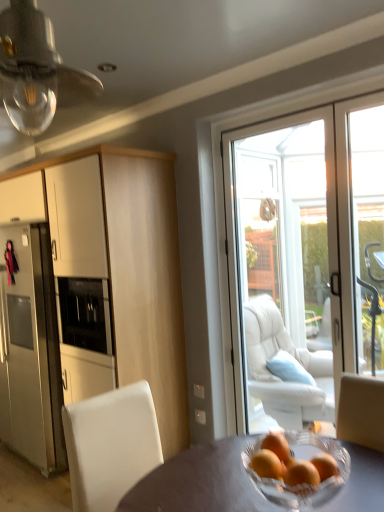
Question: Considering the relative sizes of matte gray table at center and matte white cabinet at left in the image provided, is matte gray table at center thinner than matte white cabinet at left?

Choices:
 (A) no
 (B) yes

Answer: (A)

Question: Is matte gray table at center outside of matte white cabinet at left?

Choices:
 (A) no
 (B) yes

Answer: (B)

Question: From a real-world perspective, is matte gray table at center over matte white cabinet at left?

Choices:
 (A) yes
 (B) no

Answer: (B)

Question: Is matte gray table at center oriented away from matte white cabinet at left?

Choices:
 (A) yes
 (B) no

Answer: (B)

Question: From the image's perspective, is matte gray table at center located beneath matte white cabinet at left?

Choices:
 (A) yes
 (B) no

Answer: (A)

Question: Is matte white cabinet at left inside matte gray table at center?

Choices:
 (A) yes
 (B) no

Answer: (B)

Question: Is clear glass bulb at upper left to the right of white glass door at center from the viewer's perspective?

Choices:
 (A) yes
 (B) no

Answer: (B)

Question: From a real-world perspective, is clear glass bulb at upper left on white glass door at center?

Choices:
 (A) no
 (B) yes

Answer: (B)

Question: Does clear glass bulb at upper left have a smaller size compared to white glass door at center?

Choices:
 (A) yes
 (B) no

Answer: (A)

Question: From a real-world perspective, is clear glass bulb at upper left beneath white glass door at center?

Choices:
 (A) no
 (B) yes

Answer: (A)

Question: Does clear glass bulb at upper left have a greater width compared to white glass door at center?

Choices:
 (A) yes
 (B) no

Answer: (A)

Question: Considering the relative sizes of clear glass bulb at upper left and white glass door at center in the image provided, is clear glass bulb at upper left shorter than white glass door at center?

Choices:
 (A) no
 (B) yes

Answer: (B)

Question: Can you confirm if orange matte at center is wider than clear glass bulb at upper left?

Choices:
 (A) yes
 (B) no

Answer: (B)